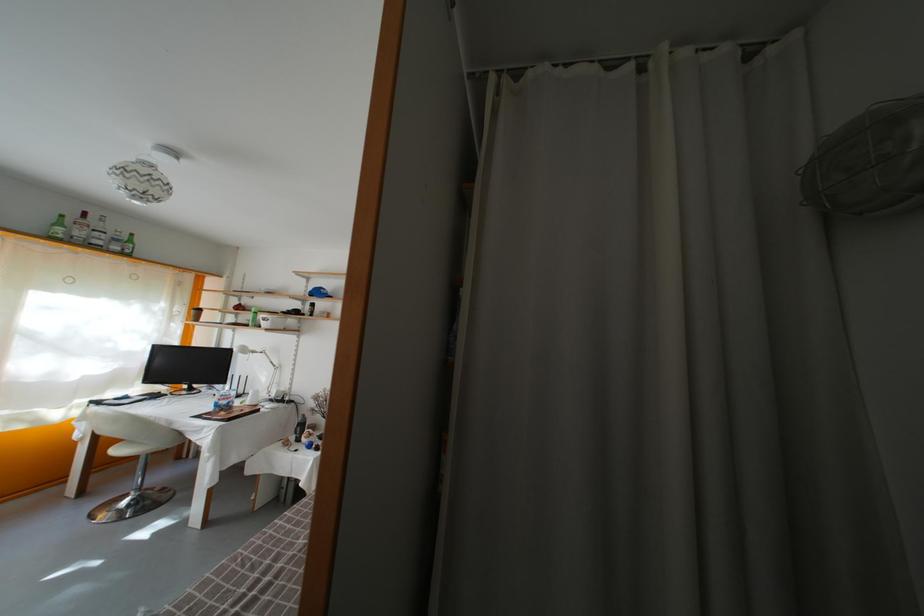
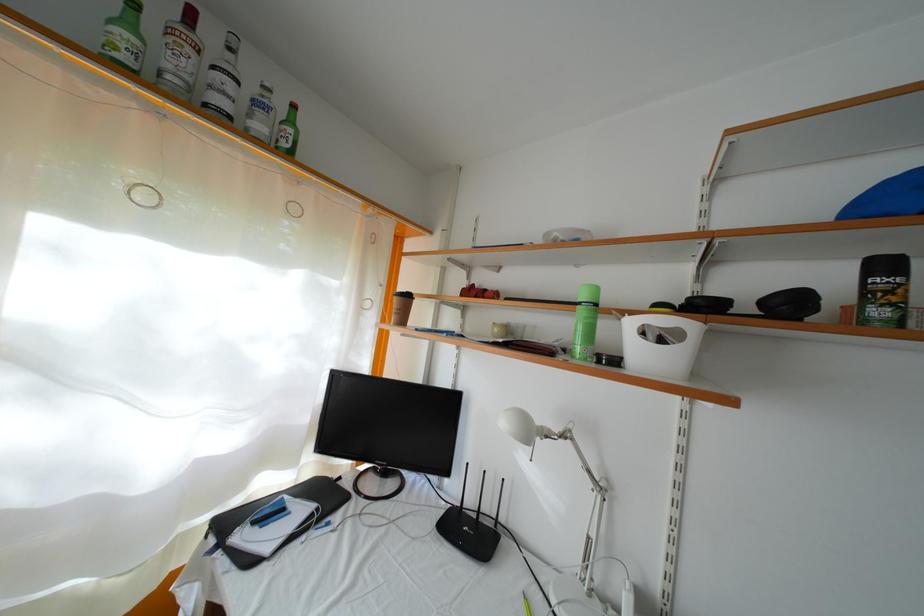
What movement of the cameraman would produce the second image?

The cameraman moved toward left, forward.